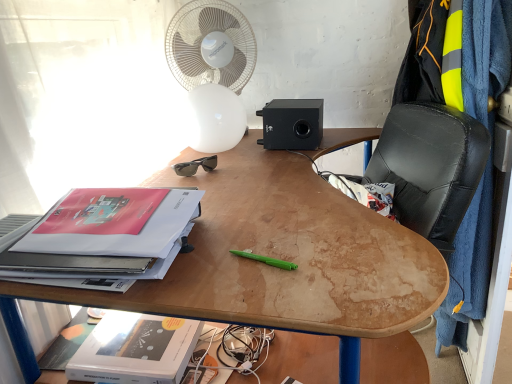
The height and width of the screenshot is (384, 512). What do you see at coordinates (430, 167) in the screenshot?
I see `black leather computer chair at center` at bounding box center [430, 167].

This screenshot has height=384, width=512. Find the location of `white matte paperback book at lower left, the second paperback book when ordered from top to bottom`. white matte paperback book at lower left, the second paperback book when ordered from top to bottom is located at coordinates (135, 349).

How much space does matte paper stack at left, which is counted as the second paperback book, starting from the bottom, occupy vertically?

The height of matte paper stack at left, which is counted as the second paperback book, starting from the bottom, is 3.50 inches.

What is the approximate width of black plastic speaker at upper center?

It is 25.05 centimeters.

Find the location of `black leather computer chair at center`. black leather computer chair at center is located at coordinates (430, 167).

Would you say wooden desk at center is inside or outside matte paper stack at left, which is counted as the second paperback book, starting from the bottom?

wooden desk at center is not enclosed by matte paper stack at left, which is counted as the second paperback book, starting from the bottom.

Could you tell me if wooden desk at center is turned towards matte paper stack at left, the first paperback book in the top-to-bottom sequence?

No, wooden desk at center does not turn towards matte paper stack at left, the first paperback book in the top-to-bottom sequence.

In the scene shown: From the image's perspective, who appears lower, wooden desk at center or matte paper stack at left, the first paperback book in the top-to-bottom sequence?

wooden desk at center is shown below in the image.

Locate an element on the screen. The height and width of the screenshot is (384, 512). the 2nd paperback book directly beneath the black plastic speaker at upper center (from a real-world perspective) is located at coordinates (135, 349).

Between black plastic speaker at upper center and white matte paperback book at lower left, the 1th paperback book ordered from the bottom, which one has less height?

With less height is white matte paperback book at lower left, the 1th paperback book ordered from the bottom.

From the picture: Can you confirm if black plastic speaker at upper center is positioned to the right of white matte paperback book at lower left, the second paperback book when ordered from top to bottom?

Correct, you'll find black plastic speaker at upper center to the right of white matte paperback book at lower left, the second paperback book when ordered from top to bottom.

Considering their positions, is black plastic speaker at upper center located in front of or behind black leather computer chair at center?

In the image, black plastic speaker at upper center appears behind black leather computer chair at center.

In terms of height, does black plastic speaker at upper center look taller or shorter compared to black leather computer chair at center?

Considering their sizes, black plastic speaker at upper center has less height than black leather computer chair at center.

Is black plastic speaker at upper center in contact with black leather computer chair at center?

No, black plastic speaker at upper center is not in contact with black leather computer chair at center.

Between white plastic fan at upper center and white matte paperback book at lower left, the 1th paperback book ordered from the bottom, which one has less height?

white matte paperback book at lower left, the 1th paperback book ordered from the bottom, is shorter.

Is white plastic fan at upper center aimed at white matte paperback book at lower left, the second paperback book when ordered from top to bottom?

Yes.

From the image's perspective, which object appears higher, white plastic fan at upper center or white matte paperback book at lower left, the 1th paperback book ordered from the bottom?

From the image's view, white plastic fan at upper center is above.

Considering the relative sizes of white plastic fan at upper center and white matte paperback book at lower left, the 1th paperback book ordered from the bottom, in the image provided, is white plastic fan at upper center thinner than white matte paperback book at lower left, the 1th paperback book ordered from the bottom,?

Yes.

Does point (145, 318) come closer to viewer compared to point (498, 85)?

That is True.

From a real-world perspective, does white matte paperback book at lower left, the 1th paperback book ordered from the bottom, stand above blue fleece blanket at right?

No, from a real-world perspective, white matte paperback book at lower left, the 1th paperback book ordered from the bottom, is not on top of blue fleece blanket at right.

Between white matte paperback book at lower left, the second paperback book when ordered from top to bottom, and blue fleece blanket at right, which one has smaller size?

white matte paperback book at lower left, the second paperback book when ordered from top to bottom, is smaller.

Which is correct: white matte paperback book at lower left, the 1th paperback book ordered from the bottom, is inside blue fleece blanket at right, or outside of it?

white matte paperback book at lower left, the 1th paperback book ordered from the bottom, is spatially situated outside blue fleece blanket at right.

Is point (116, 372) more distant than point (193, 172)?

No, (116, 372) is in front of (193, 172).

Which of these two, white matte paperback book at lower left, the second paperback book when ordered from top to bottom, or black plastic sunglasses at upper center, stands shorter?

white matte paperback book at lower left, the second paperback book when ordered from top to bottom.

From the image's perspective, is white matte paperback book at lower left, the 1th paperback book ordered from the bottom, positioned above or below black plastic sunglasses at upper center?

Clearly, from the image's perspective, white matte paperback book at lower left, the 1th paperback book ordered from the bottom, is below black plastic sunglasses at upper center.

Between wooden desk at center and green plastic pen at center, which one has less height?

Standing shorter between the two is green plastic pen at center.

Looking at the image, does wooden desk at center seem bigger or smaller compared to green plastic pen at center?

In the image, wooden desk at center appears to be larger than green plastic pen at center.

From the image's perspective, between wooden desk at center and green plastic pen at center, who is located below?

wooden desk at center, from the image's perspective.

The image size is (512, 384). I want to click on desk in front of the green plastic pen at center, so click(275, 257).

Find the location of `desk in front of the matte paper stack at left, which is counted as the second paperback book, starting from the bottom`. desk in front of the matte paper stack at left, which is counted as the second paperback book, starting from the bottom is located at coordinates (275, 257).

This screenshot has height=384, width=512. I want to click on loudspeaker above the white matte paperback book at lower left, the second paperback book when ordered from top to bottom (from a real-world perspective), so click(x=292, y=124).

In the scene shown: Estimate the real-world distances between objects in this image. Which object is closer to blue fleece blanket at right, green plastic pen at center or black leather computer chair at center?

black leather computer chair at center is closer to blue fleece blanket at right.

Looking at the image, which one is located closer to wooden desk at center, green plastic pen at center or black plastic sunglasses at upper center?

green plastic pen at center lies closer to wooden desk at center than the other object.

Considering their positions, is wooden desk at center positioned closer to black plastic sunglasses at upper center than matte paper stack at left, the first paperback book in the top-to-bottom sequence?

The object closer to black plastic sunglasses at upper center is wooden desk at center.

Which object lies further to the anchor point green plastic pen at center, matte paper stack at left, which is counted as the second paperback book, starting from the bottom, or black plastic sunglasses at upper center?

Based on the image, black plastic sunglasses at upper center appears to be further to green plastic pen at center.

Looking at the image, which one is located further to black plastic speaker at upper center, matte paper stack at left, the first paperback book in the top-to-bottom sequence, or green plastic pen at center?

green plastic pen at center is positioned further to the anchor black plastic speaker at upper center.

Based on their spatial positions, is green plastic pen at center or white matte paperback book at lower left, the second paperback book when ordered from top to bottom, closer to blue fleece blanket at right?

Among the two, green plastic pen at center is located nearer to blue fleece blanket at right.

Which object lies further to the anchor point matte paper stack at left, the first paperback book in the top-to-bottom sequence, blue fleece blanket at right or black plastic speaker at upper center?

Among the two, blue fleece blanket at right is located further to matte paper stack at left, the first paperback book in the top-to-bottom sequence.

From the image, which object appears to be farther from black leather computer chair at center, matte paper stack at left, which is counted as the second paperback book, starting from the bottom, or green plastic pen at center?

Among the two, matte paper stack at left, which is counted as the second paperback book, starting from the bottom, is located further to black leather computer chair at center.

You are a GUI agent. You are given a task and a screenshot of the screen. Output one action in this format:
    pyautogui.click(x=<x>, y=<y>)
    Task: Click on the loudspeaker positioned between wooden desk at center and white plastic fan at upper center from near to far
    This screenshot has width=512, height=384.
    Given the screenshot: What is the action you would take?
    pyautogui.click(x=292, y=124)

Identify the location of desk between white matte paperback book at lower left, the 1th paperback book ordered from the bottom, and blue fleece blanket at right from left to right. The height and width of the screenshot is (384, 512). (275, 257).

Locate an element on the screen. desk between white matte paperback book at lower left, the 1th paperback book ordered from the bottom, and black leather computer chair at center from left to right is located at coordinates (275, 257).

Find the location of a particular element. The image size is (512, 384). glasses between white matte paperback book at lower left, the second paperback book when ordered from top to bottom, and blue fleece blanket at right from left to right is located at coordinates (195, 166).